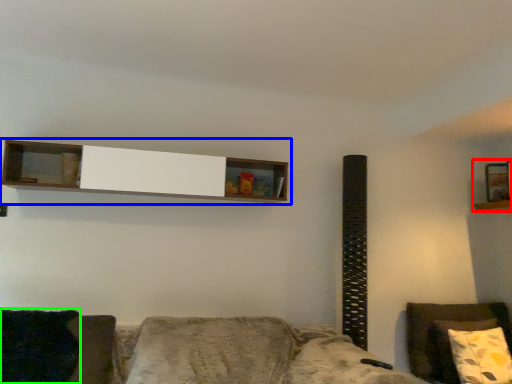
Question: Which object is the farthest from shelf (highlighted by a red box)? Choose among these: shelf (highlighted by a blue box) or pillow (highlighted by a green box).

Choices:
 (A) shelf
 (B) pillow

Answer: (B)